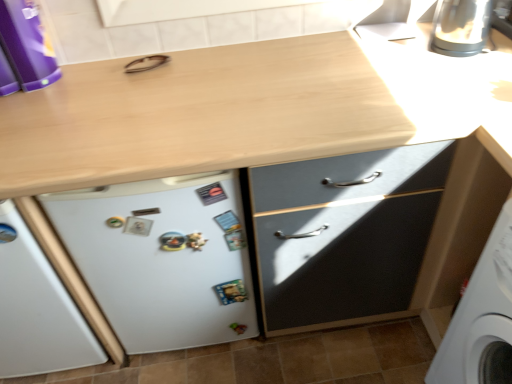
Where is `vacant space in front of purple plastic container at upper left`? The width and height of the screenshot is (512, 384). vacant space in front of purple plastic container at upper left is located at coordinates (18, 115).